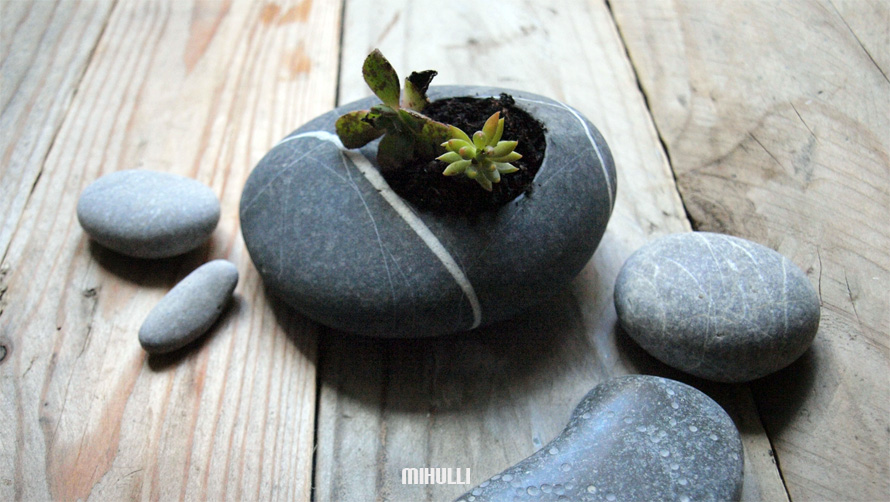
This screenshot has width=890, height=502. Identify the location of wood plank. point(27,57), point(214,52), point(488,36), point(737,56), point(879,12).